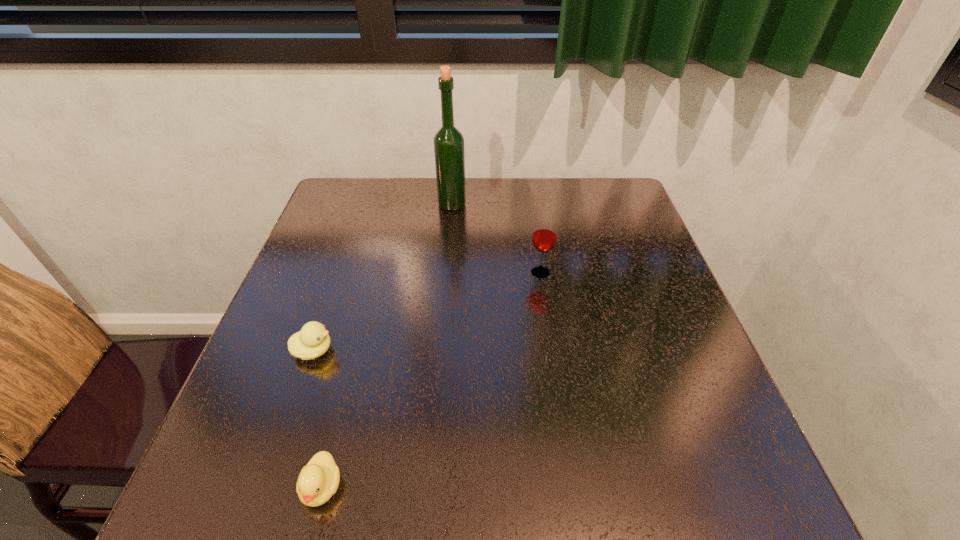
Identify the location of free space between the leftmost object and the third nearest object. (427, 312).

Locate an element on the screen. the third closest object to the rightmost object is located at coordinates (318, 480).

Locate which object is the third closest to the nearest object. Please provide its 2D coordinates. Your answer should be formatted as a tuple, i.e. [(x, y)], where the tuple contains the x and y coordinates of a point satisfying the conditions above.

[(449, 152)]

Where is `blank area in the image that satisfies the following two spatial constraints: 1. on the front side of the glass; 2. on the left side of the liquor`? Image resolution: width=960 pixels, height=540 pixels. blank area in the image that satisfies the following two spatial constraints: 1. on the front side of the glass; 2. on the left side of the liquor is located at coordinates (446, 273).